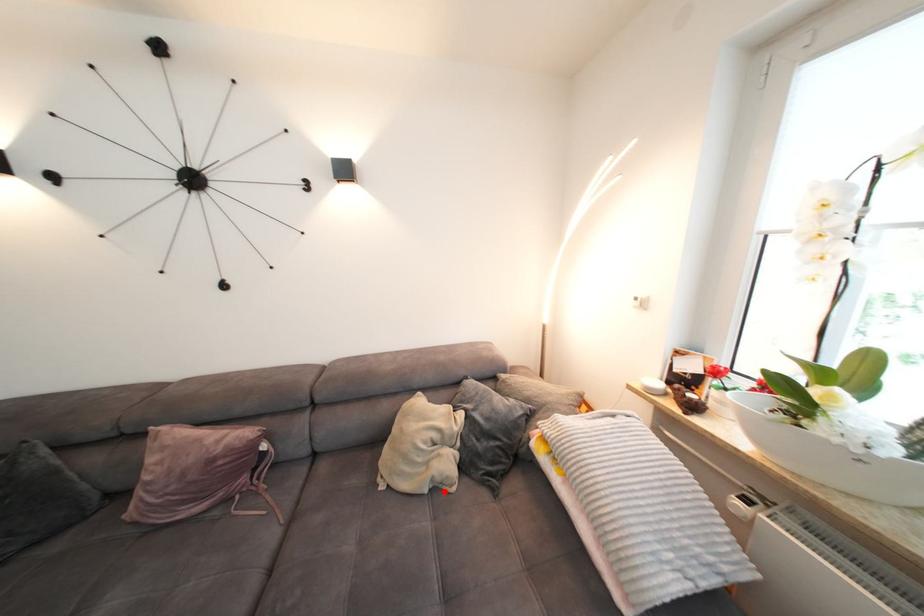
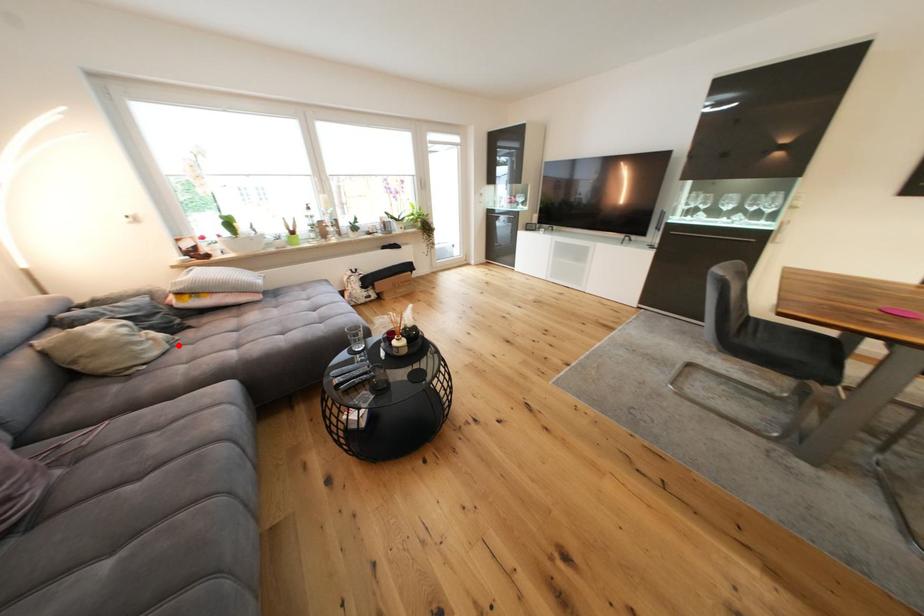
I am providing you with two images of the same scene from different viewpoints. A red point is marked on the first image and another point is marked on the second image. Does the point marked in image1 correspond to the same location as the one in image2?

Yes